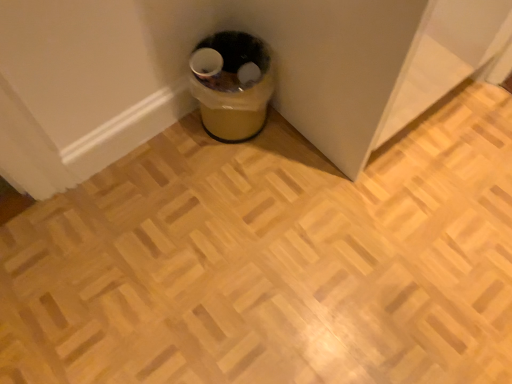
At what (x,y) coordinates should I click in order to perform the action: click on vacant space situated on the left part of yellow plastic trash can at lower left. Please return your answer as a coordinate pair (x, y). The height and width of the screenshot is (384, 512). Looking at the image, I should click on (177, 138).